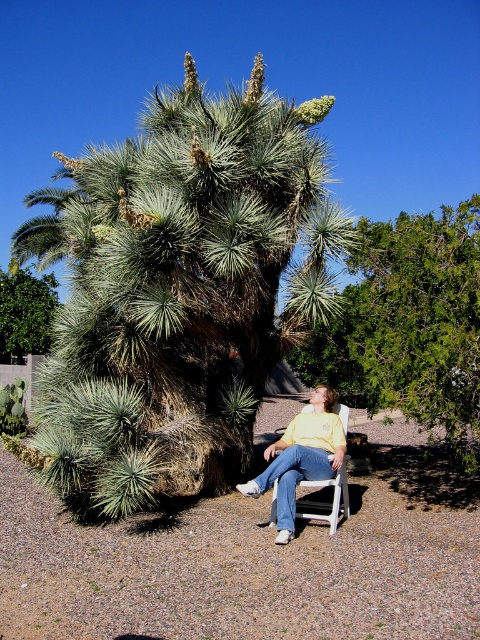
Question: Where is green needle-like at right located in relation to green leafy bush at upper left in the image?

Choices:
 (A) right
 (B) left

Answer: (A)

Question: Is green leafy bush at upper left to the left of white plastic chair at center from the viewer's perspective?

Choices:
 (A) yes
 (B) no

Answer: (A)

Question: Which of the following is the closest to the observer?

Choices:
 (A) green needle-like at right
 (B) white plastic chair at center

Answer: (B)

Question: Which object is farther from the camera taking this photo?

Choices:
 (A) green needle-like at right
 (B) white plastic chair at center
 (C) green spiky palm tree at center
 (D) green leafy bush at upper left

Answer: (D)

Question: Does green spiky palm tree at center appear under green needle-like at right?

Choices:
 (A) no
 (B) yes

Answer: (A)

Question: Which of the following is the closest to the observer?

Choices:
 (A) (313, 500)
 (B) (155, 122)
 (C) (0, 291)
 (D) (409, 317)

Answer: (D)